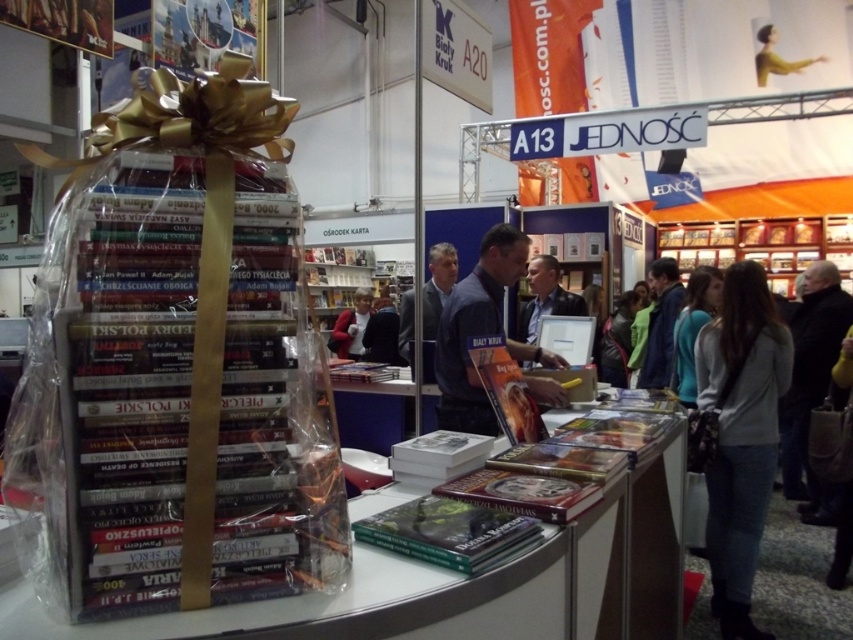
You are standing at the entrance of the book fair booth. You see two points marked in the booth layout. The first point is at coordinate point (494,298) and the second is at point (430,324). If you are facing the booth, which point is closer to you?

Point (494,298) is in front of point (430,324), so it is closer to you when facing the booth.

You are a photographer at the book fair and need to capture both the dark blue shirt at center and the dark brown leather jacket at center in a single shot. Based on their heights, which object should you focus on to ensure both are in frame without needing to adjust your camera angle?

The dark blue shirt at center is taller than the dark brown leather jacket at center, so focusing on the dark blue shirt at center will ensure both are in frame as it is the taller object.

You are at the book fair and want to take a photo of the blue fabric jacket at lower right. Where should you position yourself to capture it in the frame?

To capture the blue fabric jacket at lower right in the frame, position yourself so that the jacket is located at the coordinates point (692, 330) within the image.